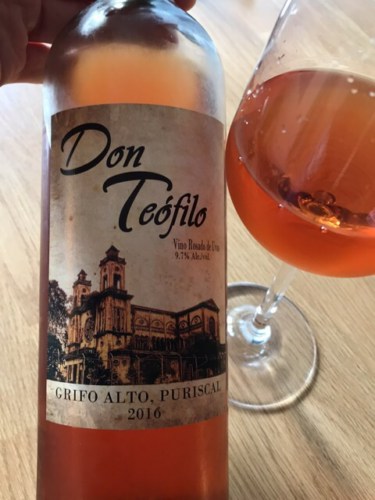
This screenshot has height=500, width=375. I want to click on wood table, so click(x=330, y=304).